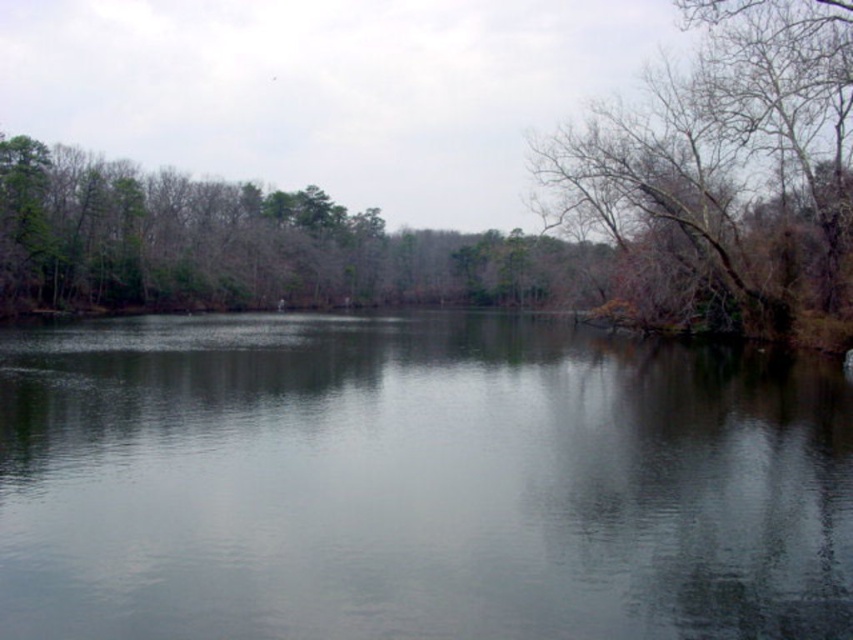
You are a photographer aiming to capture the reflection of the bare branches at right in the smooth water at center. Can you see the reflection clearly?

The smooth water at center is in front of the bare branches at right, so the reflection of the bare branches at right would be visible on the smooth water at center since the water is calm and reflective.

You are standing at the edge of the lake and want to reach the smooth water at center. According to the coordinates provided, in which direction should you walk from your current position to reach it?

The smooth water at center is located at coordinates point (415, 483). Since the question does not specify your current position relative to these coordinates, I cannot determine the direction you should walk. Please provide your current coordinates or a reference point for accurate guidance.